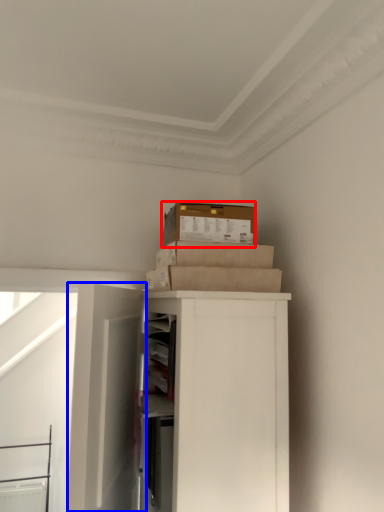
Question: Which object is further to the camera taking this photo, box (highlighted by a red box) or door (highlighted by a blue box)?

Choices:
 (A) box
 (B) door

Answer: (A)